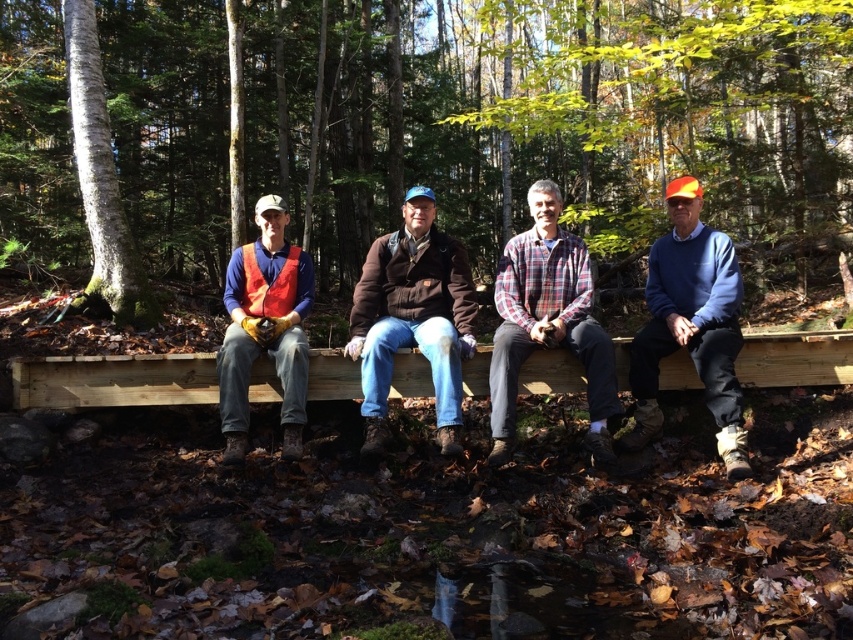
Between point (720, 316) and point (660, 332), which one is positioned behind?

The point (660, 332) is behind.

Measure the distance between matte black jacket at center and camera.

matte black jacket at center is 3.43 meters from camera.

At what (x,y) coordinates should I click in order to perform the action: click on matte black jacket at center. Please return your answer as a coordinate pair (x, y). Image resolution: width=853 pixels, height=640 pixels. Looking at the image, I should click on (547, 321).

Locate an element on the screen. matte black jacket at center is located at coordinates point(547,321).

What do you see at coordinates (413, 317) in the screenshot?
I see `brown leather jacket at center` at bounding box center [413, 317].

Can you confirm if brown leather jacket at center is smaller than matte orange vest at left?

No.

Does point (450, 440) come farther from viewer compared to point (222, 388)?

No, (450, 440) is in front of (222, 388).

The width and height of the screenshot is (853, 640). What are the coordinates of `brown leather jacket at center` in the screenshot? It's located at (413, 317).

Between matte black jacket at center and light brown wood bench at center, which one is positioned higher?

matte black jacket at center is higher up.

Can you confirm if matte black jacket at center is thinner than light brown wood bench at center?

No, matte black jacket at center is not thinner than light brown wood bench at center.

Does point (734, 285) come farther from viewer compared to point (840, 333)?

No.

The image size is (853, 640). What are the coordinates of `matte black jacket at center` in the screenshot? It's located at (547, 321).